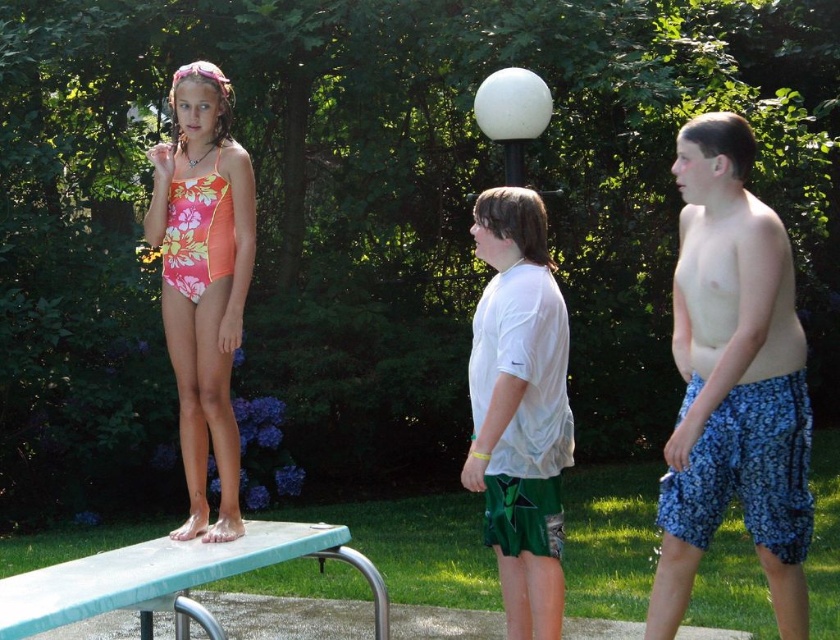
You are a photographer trying to capture a photo of the two people in the scene. You notice the blue floral shorts at right and the floral print swimsuit at center. Which object should you focus on if you want to capture the one that is taller?

The blue floral shorts at right is taller than the floral print swimsuit at center, so you should focus on the blue floral shorts at right.

You are a photographer setting up a shot of the two people at the center of the image. You need to ensure that the white matte shirt at center and the floral print swimsuit at center are both visible in the frame. Given their sizes, which object should you prioritize keeping in focus to ensure it doesn?t get cropped out?

The white matte shirt at center has a lesser width compared to the floral print swimsuit at center, so you should prioritize keeping the floral print swimsuit at center in focus to ensure it doesn?t get cropped out since it is wider and might require more space in the frame.